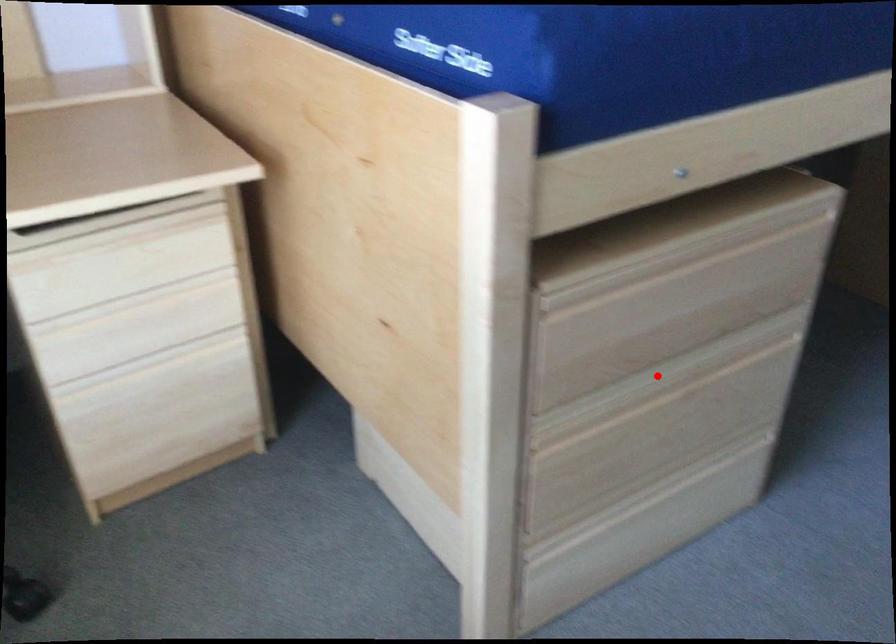
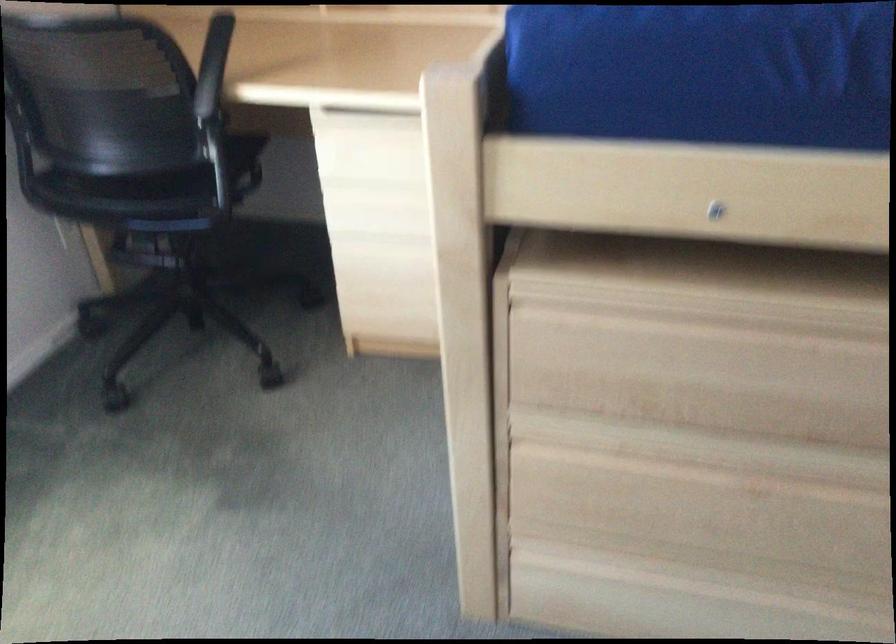
The point at the highlighted location is marked in the first image. Where is the corresponding point in the second image?

(716, 451)